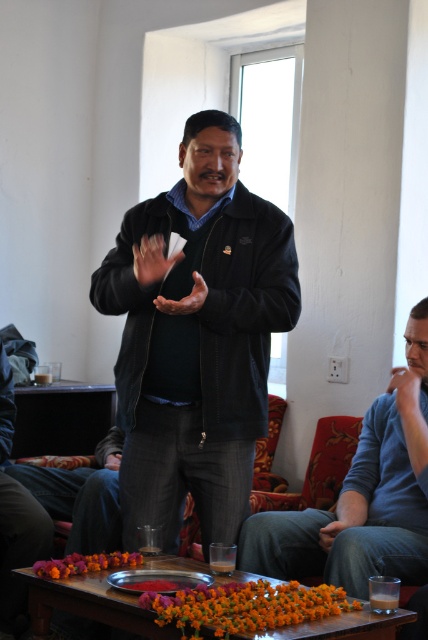
Question: Which point is farther to the camera?

Choices:
 (A) black matte jacket at center
 (B) brown leather hand at center

Answer: (A)

Question: Is blue cotton shirt at center wider than matte black hand at center?

Choices:
 (A) yes
 (B) no

Answer: (A)

Question: Does black matte jacket at center appear over matte black hand at center?

Choices:
 (A) yes
 (B) no

Answer: (B)

Question: Which of the following is the closest to the observer?

Choices:
 (A) matte skin hand at upper right
 (B) matte black hand at center
 (C) brown leather hand at center
 (D) black matte jacket at center

Answer: (C)

Question: Among these points, which one is farthest from the camera?

Choices:
 (A) (397, 400)
 (B) (214, 444)
 (C) (401, 440)

Answer: (C)

Question: Is black matte jacket at center positioned in front of brown leather hand at center?

Choices:
 (A) no
 (B) yes

Answer: (A)